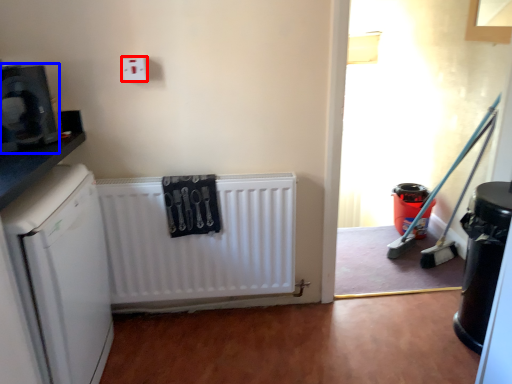
Question: Among these objects, which one is farthest to the camera, electric outlet (highlighted by a red box) or appliance (highlighted by a blue box)?

Choices:
 (A) electric outlet
 (B) appliance

Answer: (A)